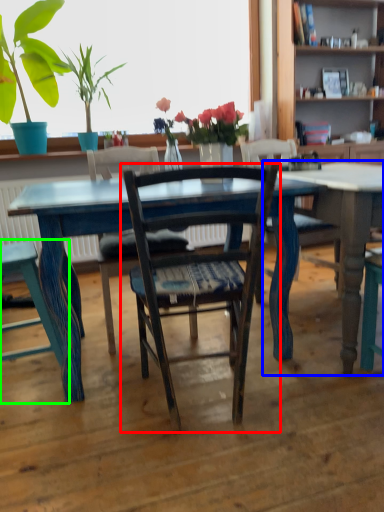
Question: Considering the real-world distances, which object is closest to chair (highlighted by a red box)? table (highlighted by a blue box) or chair (highlighted by a green box).

Choices:
 (A) table
 (B) chair

Answer: (A)